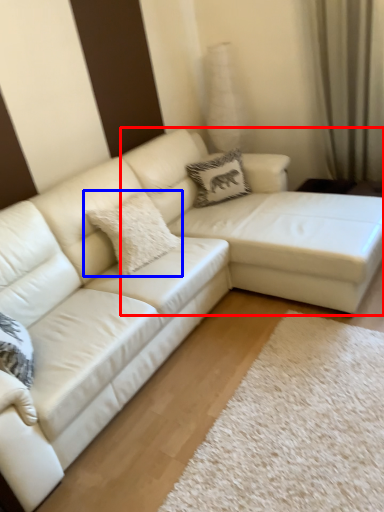
Question: Which object appears farthest to the camera in this image, couch (highlighted by a red box) or pillow (highlighted by a blue box)?

Choices:
 (A) couch
 (B) pillow

Answer: (B)